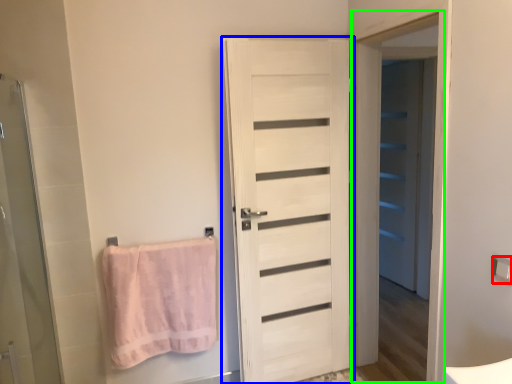
Question: Which object is positioned farthest from towel bar (highlighted by a red box)? Select from door (highlighted by a blue box) and screen door (highlighted by a green box).

Choices:
 (A) door
 (B) screen door

Answer: (A)